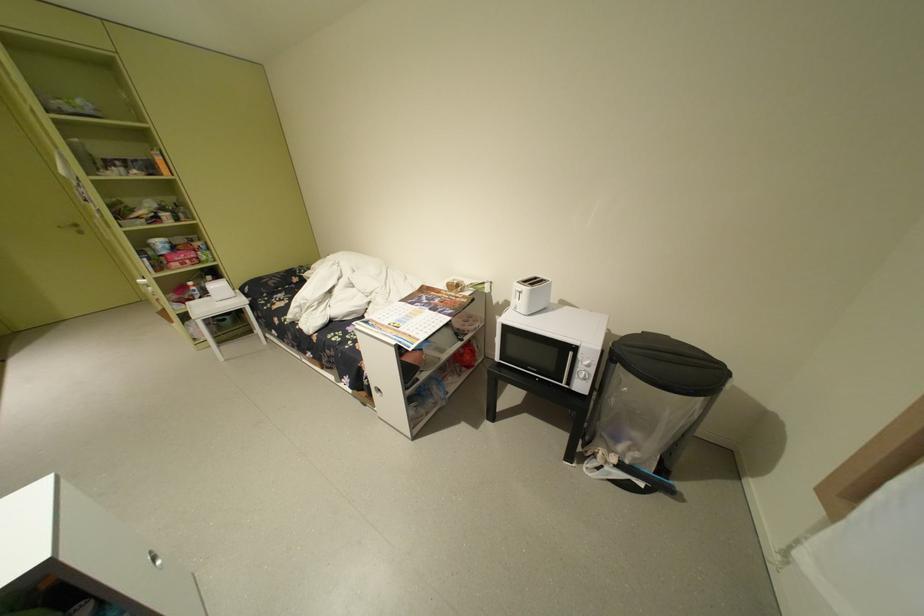
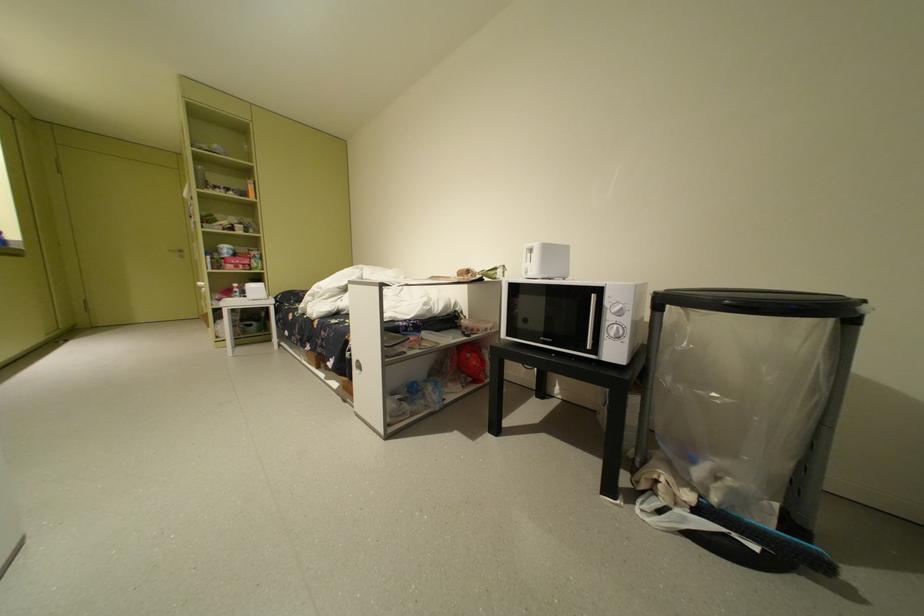
Question: The images are taken continuously from a first-person perspective. In which direction is your viewpoint rotating?

Choices:
 (A) Left
 (B) Right
 (C) Up
 (D) Down

Answer: (C)